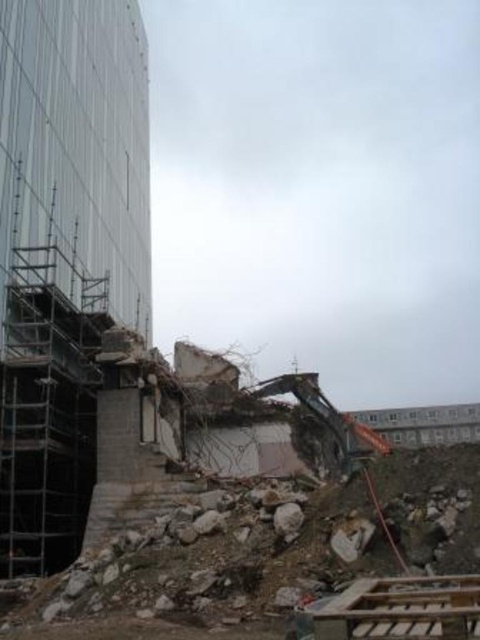
Which of these two, rubble concrete at lower center or metallic gray excavator at center, stands shorter?

rubble concrete at lower center is shorter.

Is rubble concrete at lower center closer to camera compared to metallic gray excavator at center?

Yes, rubble concrete at lower center is in front of metallic gray excavator at center.

Who is more distant from viewer, (131, 584) or (344, 422)?

Positioned behind is point (344, 422).

Locate an element on the screen. Image resolution: width=480 pixels, height=640 pixels. rubble concrete at lower center is located at coordinates (210, 572).